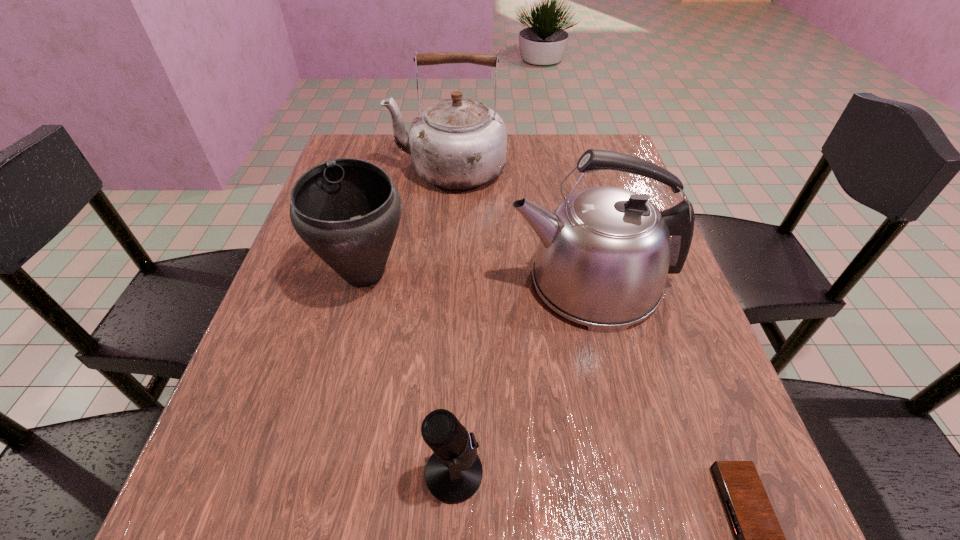
Image resolution: width=960 pixels, height=540 pixels. What are the coordinates of `blank space at the right edge` in the screenshot? It's located at (660, 319).

Locate an element on the screen. vacant region at the far left corner of the desktop is located at coordinates (375, 138).

Find the location of `free space at the far right corner of the desktop`. free space at the far right corner of the desktop is located at coordinates (568, 139).

Locate an element on the screen. This screenshot has width=960, height=540. empty space between the nearer kettle and the urn is located at coordinates (477, 278).

This screenshot has height=540, width=960. Identify the location of vacant area between the nearer kettle and the urn. pos(477,278).

At what (x,y) coordinates should I click in order to perform the action: click on free space between the fourth tallest object and the third shortest object. Please return your answer as a coordinate pair (x, y). Looking at the image, I should click on (409, 374).

The height and width of the screenshot is (540, 960). Identify the location of free area in between the fourth tallest object and the farthest object. (451, 321).

This screenshot has width=960, height=540. Find the location of `free space between the nearer kettle and the microphone`. free space between the nearer kettle and the microphone is located at coordinates (522, 377).

The width and height of the screenshot is (960, 540). Identify the location of the closest object to the farther kettle. (604, 254).

Select which object appears as the fourth closest to the nearer kettle. Please provide its 2D coordinates. Your answer should be formatted as a tuple, i.e. [(x, y)], where the tuple contains the x and y coordinates of a point satisfying the conditions above.

[(759, 539)]